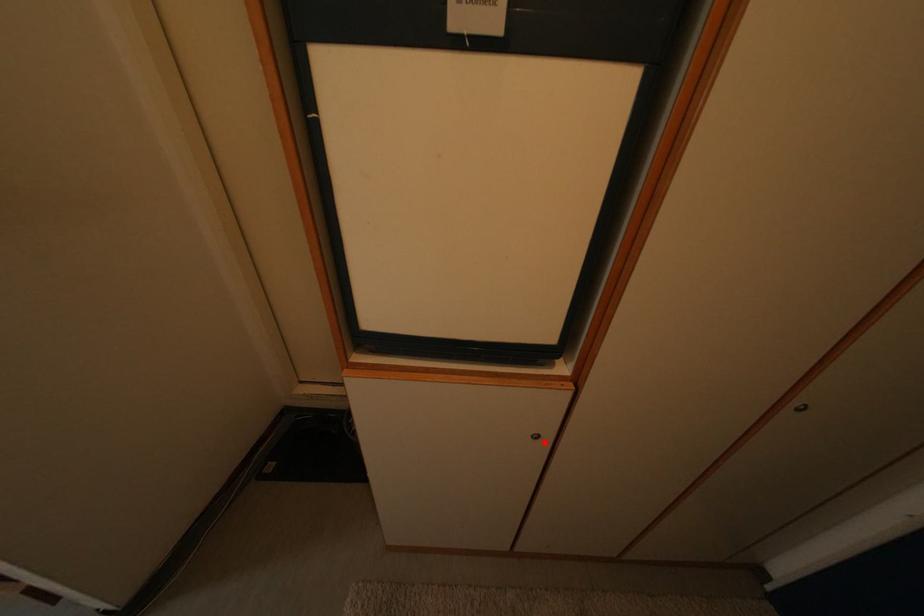
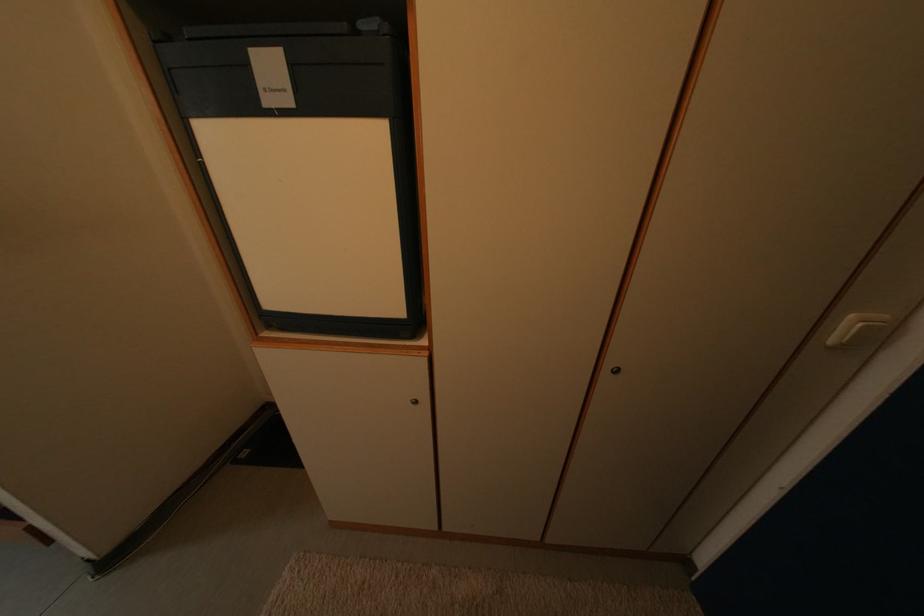
Where in the second image is the point corresponding to the highlighted location from the first image?

(423, 408)